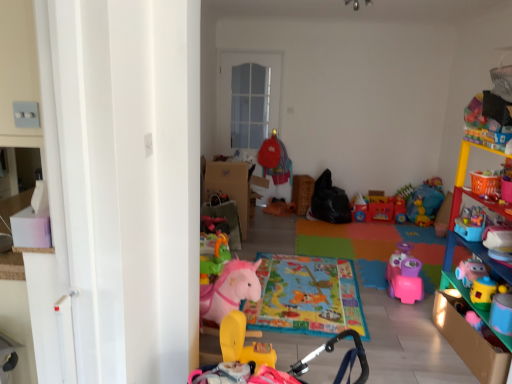
The height and width of the screenshot is (384, 512). What do you see at coordinates (243, 343) in the screenshot? I see `rubber yellow horse at center, acting as the first toy starting from the back` at bounding box center [243, 343].

What is the approximate height of multicolored plastic shelf at right?

1.74 meters.

This screenshot has height=384, width=512. I want to click on multicolored plastic shelf at right, so click(x=464, y=176).

What are the coordinates of `rubber yellow horse at center, acting as the first toy starting from the back` in the screenshot? It's located at (243, 343).

Is multicolored plastic shelf at right situated inside rubber yellow rocking horse at lower center, the second toy from the back, or outside?

multicolored plastic shelf at right is not enclosed by rubber yellow rocking horse at lower center, the second toy from the back.

Is multicolored plastic shelf at right looking in the opposite direction of rubber yellow rocking horse at lower center, the second toy from the back?

No.

In terms of height, does multicolored plastic shelf at right look taller or shorter compared to rubber yellow rocking horse at lower center, the 1th toy positioned from the front?

In the image, multicolored plastic shelf at right appears to be taller than rubber yellow rocking horse at lower center, the 1th toy positioned from the front.

Considering the sizes of objects multicolored plastic shelf at right and rubber yellow rocking horse at lower center, the second toy from the back, in the image provided, who is smaller, multicolored plastic shelf at right or rubber yellow rocking horse at lower center, the second toy from the back,?

rubber yellow rocking horse at lower center, the second toy from the back, is smaller.

Which object is thinner, rubber yellow horse at center, acting as the first toy starting from the back, or rubber yellow rocking horse at lower center, the 1th toy positioned from the front?

Thinner between the two is rubber yellow horse at center, acting as the first toy starting from the back.

In the scene shown: Does rubber yellow horse at center, acting as the first toy starting from the back, appear on the left side of rubber yellow rocking horse at lower center, the 1th toy positioned from the front?

Indeed, rubber yellow horse at center, acting as the first toy starting from the back, is positioned on the left side of rubber yellow rocking horse at lower center, the 1th toy positioned from the front.

From a real-world perspective, is rubber yellow horse at center, the 2th toy from the front, on rubber yellow rocking horse at lower center, the 1th toy positioned from the front?

Actually, rubber yellow horse at center, the 2th toy from the front, is physically below rubber yellow rocking horse at lower center, the 1th toy positioned from the front, in the real world.

In the image, is rubber yellow horse at center, acting as the first toy starting from the back, positioned in front of or behind rubber yellow rocking horse at lower center, the second toy from the back?

rubber yellow horse at center, acting as the first toy starting from the back, is positioned farther from the viewer than rubber yellow rocking horse at lower center, the second toy from the back.

Is rubber yellow rocking horse at lower center, the 1th toy positioned from the front, aimed at rubber yellow horse at center, acting as the first toy starting from the back?

No, rubber yellow rocking horse at lower center, the 1th toy positioned from the front, is not facing towards rubber yellow horse at center, acting as the first toy starting from the back.

From the image's perspective, which one is positioned higher, rubber yellow rocking horse at lower center, the 1th toy positioned from the front, or rubber yellow horse at center, the 2th toy from the front?

rubber yellow rocking horse at lower center, the 1th toy positioned from the front, from the image's perspective.

Is point (194, 377) closer to camera compared to point (222, 356)?

Yes, point (194, 377) is closer to viewer.

This screenshot has height=384, width=512. Find the location of `toy in front of the rubber yellow horse at center, acting as the first toy starting from the back`. toy in front of the rubber yellow horse at center, acting as the first toy starting from the back is located at coordinates (238, 341).

In the image, is multicolored plastic shelf at right positioned in front of or behind rubber yellow horse at center, the 2th toy from the front?

Clearly, multicolored plastic shelf at right is in front of rubber yellow horse at center, the 2th toy from the front.

Based on the photo, who is shorter, multicolored plastic shelf at right or rubber yellow horse at center, acting as the first toy starting from the back?

rubber yellow horse at center, acting as the first toy starting from the back.

Are multicolored plastic shelf at right and rubber yellow horse at center, acting as the first toy starting from the back, far apart?

Yes, multicolored plastic shelf at right and rubber yellow horse at center, acting as the first toy starting from the back, are quite far apart.

Is the position of rubber yellow rocking horse at lower center, the second toy from the back, more distant than that of multicolored plastic shelf at right?

No.

Could multicolored plastic shelf at right be considered to be inside rubber yellow rocking horse at lower center, the 1th toy positioned from the front?

No.

From a real-world perspective, is rubber yellow rocking horse at lower center, the 1th toy positioned from the front, over multicolored plastic shelf at right?

Actually, rubber yellow rocking horse at lower center, the 1th toy positioned from the front, is physically below multicolored plastic shelf at right in the real world.

Can you confirm if rubber yellow rocking horse at lower center, the second toy from the back, is taller than multicolored plastic shelf at right?

In fact, rubber yellow rocking horse at lower center, the second toy from the back, may be shorter than multicolored plastic shelf at right.

From a real-world perspective, does rubber yellow horse at center, the 2th toy from the front, stand above multicolored plastic shelf at right?

No, from a real-world perspective, rubber yellow horse at center, the 2th toy from the front, is not over multicolored plastic shelf at right

Which of these two, rubber yellow horse at center, acting as the first toy starting from the back, or multicolored plastic shelf at right, stands taller?

With more height is multicolored plastic shelf at right.

Is rubber yellow horse at center, acting as the first toy starting from the back, thinner than multicolored plastic shelf at right?

No, rubber yellow horse at center, acting as the first toy starting from the back, is not thinner than multicolored plastic shelf at right.

Find the location of a particular element. shelf above the rubber yellow rocking horse at lower center, the 1th toy positioned from the front (from a real-world perspective) is located at coordinates (464, 176).

Find the location of a particular element. The width and height of the screenshot is (512, 384). toy below the rubber yellow rocking horse at lower center, the second toy from the back (from the image's perspective) is located at coordinates (243, 343).

Based on their spatial positions, is multicolored plastic shelf at right or rubber yellow rocking horse at lower center, the second toy from the back, closer to rubber yellow horse at center, the 2th toy from the front?

rubber yellow rocking horse at lower center, the second toy from the back, is closer to rubber yellow horse at center, the 2th toy from the front.

From the image, which object appears to be nearer to multicolored plastic shelf at right, rubber yellow rocking horse at lower center, the 1th toy positioned from the front, or rubber yellow horse at center, the 2th toy from the front?

rubber yellow rocking horse at lower center, the 1th toy positioned from the front, is positioned closer to the anchor multicolored plastic shelf at right.

Looking at the image, which one is located closer to rubber yellow rocking horse at lower center, the 1th toy positioned from the front, rubber yellow horse at center, acting as the first toy starting from the back, or multicolored plastic shelf at right?

Among the two, rubber yellow horse at center, acting as the first toy starting from the back, is located nearer to rubber yellow rocking horse at lower center, the 1th toy positioned from the front.

Which object lies nearer to the anchor point rubber yellow rocking horse at lower center, the 1th toy positioned from the front, multicolored plastic shelf at right or rubber yellow horse at center, acting as the first toy starting from the back?

The object closer to rubber yellow rocking horse at lower center, the 1th toy positioned from the front, is rubber yellow horse at center, acting as the first toy starting from the back.

Which object lies nearer to the anchor point multicolored plastic shelf at right, rubber yellow horse at center, acting as the first toy starting from the back, or rubber yellow rocking horse at lower center, the 1th toy positioned from the front?

rubber yellow rocking horse at lower center, the 1th toy positioned from the front, lies closer to multicolored plastic shelf at right than the other object.

Estimate the real-world distances between objects in this image. Which object is closer to rubber yellow horse at center, the 2th toy from the front, rubber yellow rocking horse at lower center, the second toy from the back, or multicolored plastic shelf at right?

Among the two, rubber yellow rocking horse at lower center, the second toy from the back, is located nearer to rubber yellow horse at center, the 2th toy from the front.

This screenshot has width=512, height=384. Identify the location of toy between rubber yellow horse at center, acting as the first toy starting from the back, and multicolored plastic shelf at right from left to right. (238, 341).